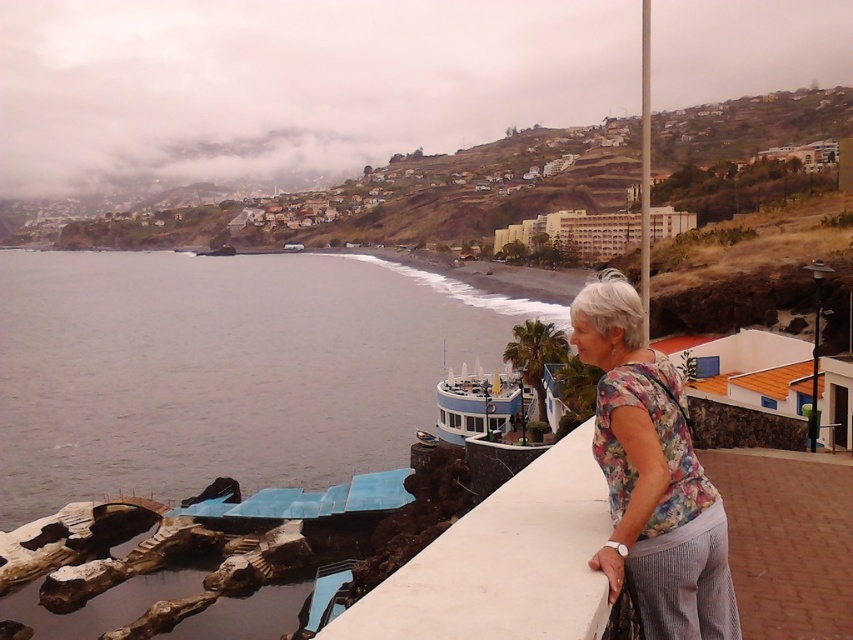
You are standing at the edge of the white concrete ledge at lower right and want to walk towards the gray water at lower left. Is the path directly between them clear of any obstacles?

The gray water at lower left is further to the viewer than the white concrete ledge at lower right, so the path between them is clear since the water is closer to the viewer and the ledge is further away.

You are a photographer trying to capture the scenic coastal view. You notice the white concrete ledge at lower right and the floral fabric blouse at right in your frame. Which object is closer to the camera based on their positions?

The white concrete ledge at lower right is positioned under the floral fabric blouse at right, indicating it is closer to the camera.

You are standing at the center of the image and want to locate the gray water at lower left. According to the coordinates provided, in which direction should you look to find it?

The gray water at lower left is located at point (222, 369), so you should look to your lower left direction to find it.